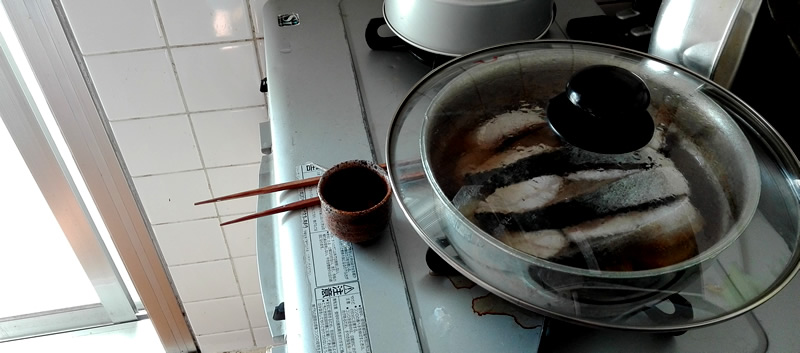
Find the location of a particular element. The width and height of the screenshot is (800, 353). stove is located at coordinates pyautogui.click(x=501, y=343), pyautogui.click(x=374, y=69).